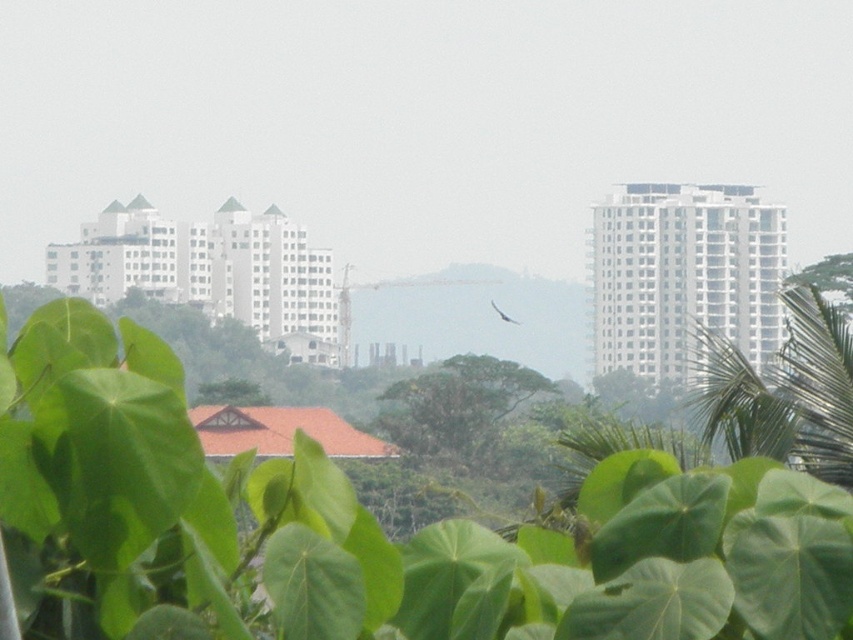
Consider the image. Who is more forward, [421,608] or [494,305]?

Point [421,608] is more forward.

Does point (61, 451) lie behind point (506, 321)?

That is False.

Where is `green leafy plant at center`? The width and height of the screenshot is (853, 640). green leafy plant at center is located at coordinates (367, 528).

At what (x,y) coordinates should I click in order to perform the action: click on green leafy plant at center. Please return your answer as a coordinate pair (x, y). The height and width of the screenshot is (640, 853). Looking at the image, I should click on (367, 528).

Who is higher up, green leafy tree at center or white glossy bird at center?

white glossy bird at center is above.

Who is positioned more to the right, green leafy tree at center or white glossy bird at center?

From the viewer's perspective, white glossy bird at center appears more on the right side.

Who is more distant from viewer, (477,385) or (498,314)?

The point (498,314) is more distant.

Find the location of a particular element. The height and width of the screenshot is (640, 853). green leafy tree at center is located at coordinates 456,404.

Who is higher up, green leafy plant at center or green leafy tree at center?

green leafy plant at center is above.

Who is lower down, green leafy plant at center or green leafy tree at center?

green leafy tree at center is lower down.

Describe the element at coordinates (367, 528) in the screenshot. The height and width of the screenshot is (640, 853). I see `green leafy plant at center` at that location.

Image resolution: width=853 pixels, height=640 pixels. I want to click on green leafy plant at center, so click(367, 528).